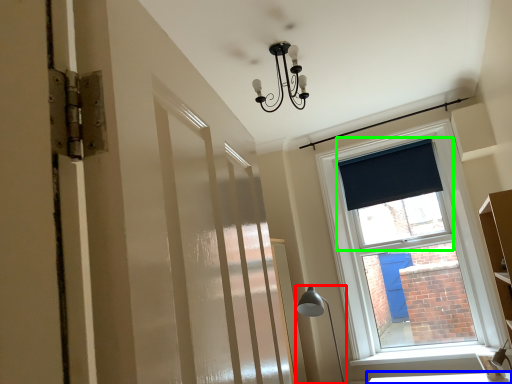
Question: Estimate the real-world distances between objects in this image. Which object is closer to table lamp (highlighted by a red box), table (highlighted by a blue box) or window screen (highlighted by a green box)?

Choices:
 (A) table
 (B) window screen

Answer: (A)